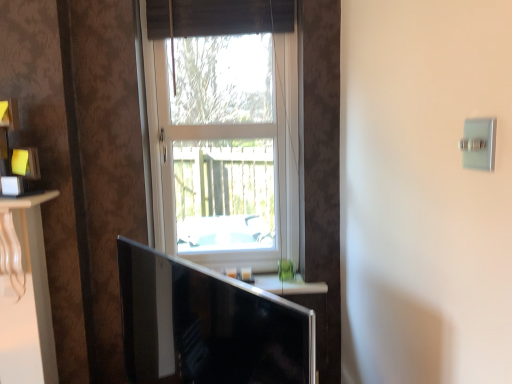
What do you see at coordinates (207, 325) in the screenshot? The image size is (512, 384). I see `black glossy monitor at lower center` at bounding box center [207, 325].

This screenshot has height=384, width=512. I want to click on brown woven curtain at upper center, so click(218, 17).

The image size is (512, 384). Describe the element at coordinates (224, 148) in the screenshot. I see `white frame window at center` at that location.

Where is `satin silver switch at upper right`? The image size is (512, 384). satin silver switch at upper right is located at coordinates pyautogui.click(x=479, y=143).

Considering the sizes of objects white frame window at center and satin silver switch at upper right in the image provided, who is bigger, white frame window at center or satin silver switch at upper right?

Bigger between the two is white frame window at center.

I want to click on light switch below the white frame window at center (from the image's perspective), so click(x=479, y=143).

From the picture: Is white frame window at center facing away from satin silver switch at upper right?

No, white frame window at center is not facing the opposite direction of satin silver switch at upper right.

Considering the relative positions of white frame window at center and satin silver switch at upper right in the image provided, is white frame window at center to the left of satin silver switch at upper right from the viewer's perspective?

Yes.

In terms of size, does black glossy monitor at lower center appear bigger or smaller than brown woven curtain at upper center?

black glossy monitor at lower center is bigger than brown woven curtain at upper center.

Is black glossy monitor at lower center inside the boundaries of brown woven curtain at upper center, or outside?

black glossy monitor at lower center is located beyond the bounds of brown woven curtain at upper center.

Is black glossy monitor at lower center positioned with its back to brown woven curtain at upper center?

No.

Which is closer to the camera, [207,382] or [151,0]?

The point [207,382] is in front.

How far apart are brown woven curtain at upper center and white frame window at center?

brown woven curtain at upper center is 38.24 centimeters away from white frame window at center.

Considering the relative sizes of brown woven curtain at upper center and white frame window at center in the image provided, is brown woven curtain at upper center thinner than white frame window at center?

No, brown woven curtain at upper center is not thinner than white frame window at center.

Is brown woven curtain at upper center far from white frame window at center?

They are positioned close to each other.

Is brown woven curtain at upper center aimed at white frame window at center?

Yes, brown woven curtain at upper center is facing white frame window at center.

You are a GUI agent. You are given a task and a screenshot of the screen. Output one action in this format:
    pyautogui.click(x=<x>, y=<y>)
    Task: Click on the window located behind the black glossy monitor at lower center
    
    Given the screenshot: What is the action you would take?
    pyautogui.click(x=224, y=148)

Is black glossy monitor at lower center taller or shorter than white frame window at center?

In the image, black glossy monitor at lower center appears to be shorter than white frame window at center.

In terms of width, does black glossy monitor at lower center look wider or thinner when compared to white frame window at center?

Considering their sizes, black glossy monitor at lower center looks broader than white frame window at center.

How different are the orientations of satin silver switch at upper right and white frame window at center in degrees?

88.5 degrees separate the facing orientations of satin silver switch at upper right and white frame window at center.

Which is farther, (x=480, y=128) or (x=271, y=194)?

Point (x=271, y=194)

From the picture: Is satin silver switch at upper right situated inside white frame window at center or outside?

satin silver switch at upper right is outside white frame window at center.

Is satin silver switch at upper right oriented towards black glossy monitor at lower center?

No.

Considering the points (472, 131) and (239, 296), which point is in front, point (472, 131) or point (239, 296)?

The point (472, 131) is closer.

Is satin silver switch at upper right next to black glossy monitor at lower center?

satin silver switch at upper right and black glossy monitor at lower center are not in contact.

Who is more distant, satin silver switch at upper right or black glossy monitor at lower center?

satin silver switch at upper right is more distant.

Which object is closer to the camera taking this photo, brown woven curtain at upper center or black glossy monitor at lower center?

black glossy monitor at lower center is in front.

Is brown woven curtain at upper center to the left of black glossy monitor at lower center from the viewer's perspective?

No.

Is black glossy monitor at lower center located within brown woven curtain at upper center?

Actually, black glossy monitor at lower center is outside brown woven curtain at upper center.

Does brown woven curtain at upper center have a larger size compared to black glossy monitor at lower center?

Actually, brown woven curtain at upper center might be smaller than black glossy monitor at lower center.

Identify the location of window on the left of satin silver switch at upper right. point(224,148).

Locate an element on the screen. Image resolution: width=512 pixels, height=384 pixels. computer monitor lying below the brown woven curtain at upper center (from the image's perspective) is located at coordinates (207, 325).

Which object lies further to the anchor point brown woven curtain at upper center, black glossy monitor at lower center or satin silver switch at upper right?

Among the two, satin silver switch at upper right is located further to brown woven curtain at upper center.

When comparing their distances from brown woven curtain at upper center, does satin silver switch at upper right or black glossy monitor at lower center seem further?

Based on the image, satin silver switch at upper right appears to be further to brown woven curtain at upper center.

When comparing their distances from satin silver switch at upper right, does white frame window at center or black glossy monitor at lower center seem further?

white frame window at center is positioned further to the anchor satin silver switch at upper right.

From the image, which object appears to be nearer to black glossy monitor at lower center, brown woven curtain at upper center or white frame window at center?

Based on the image, white frame window at center appears to be nearer to black glossy monitor at lower center.

When comparing their distances from white frame window at center, does black glossy monitor at lower center or satin silver switch at upper right seem closer?

black glossy monitor at lower center.

Which object lies further to the anchor point brown woven curtain at upper center, white frame window at center or satin silver switch at upper right?

Among the two, satin silver switch at upper right is located further to brown woven curtain at upper center.

Which object lies nearer to the anchor point brown woven curtain at upper center, satin silver switch at upper right or white frame window at center?

Based on the image, white frame window at center appears to be nearer to brown woven curtain at upper center.

Considering their positions, is satin silver switch at upper right positioned closer to white frame window at center than brown woven curtain at upper center?

The object closer to white frame window at center is brown woven curtain at upper center.

Locate an element on the screen. The height and width of the screenshot is (384, 512). curtain between satin silver switch at upper right and white frame window at center along the z-axis is located at coordinates pos(218,17).

Where is `light switch between brown woven curtain at upper center and black glossy monitor at lower center in the up-down direction`? The image size is (512, 384). light switch between brown woven curtain at upper center and black glossy monitor at lower center in the up-down direction is located at coordinates (479, 143).

Find the location of a particular element. This screenshot has height=384, width=512. window between brown woven curtain at upper center and black glossy monitor at lower center in the vertical direction is located at coordinates (224, 148).

Locate an element on the screen. This screenshot has width=512, height=384. light switch located between black glossy monitor at lower center and white frame window at center in the depth direction is located at coordinates (479, 143).